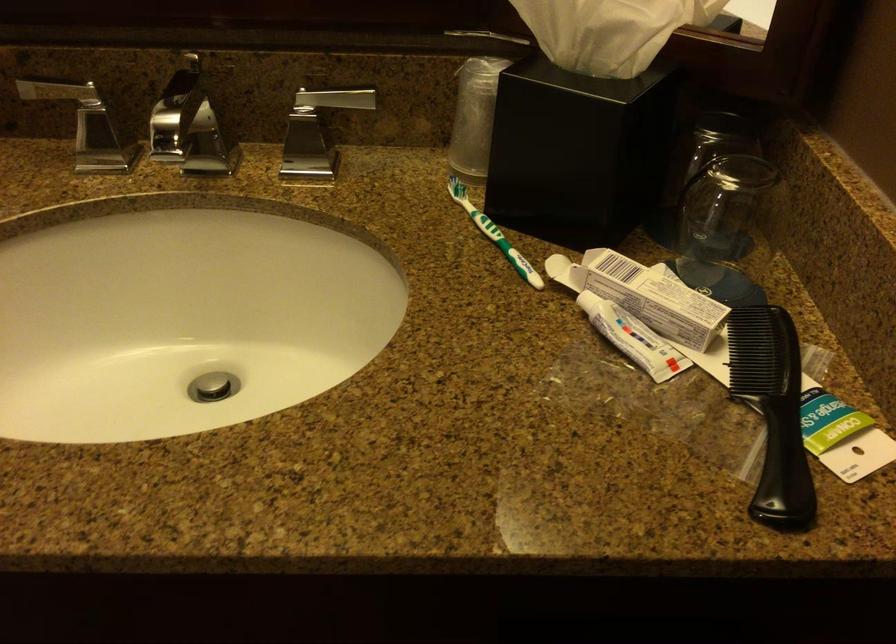
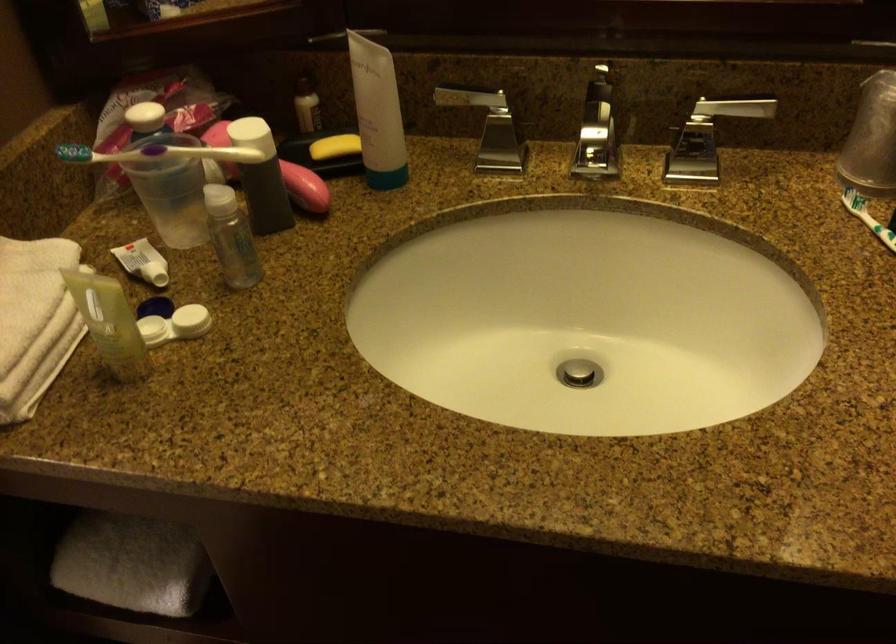
Question: Based on the continuous images, in which direction is the camera rotating? Reply with the corresponding letter.

Choices:
 (A) Left
 (B) Right
 (C) Up
 (D) Down

Answer: (A)